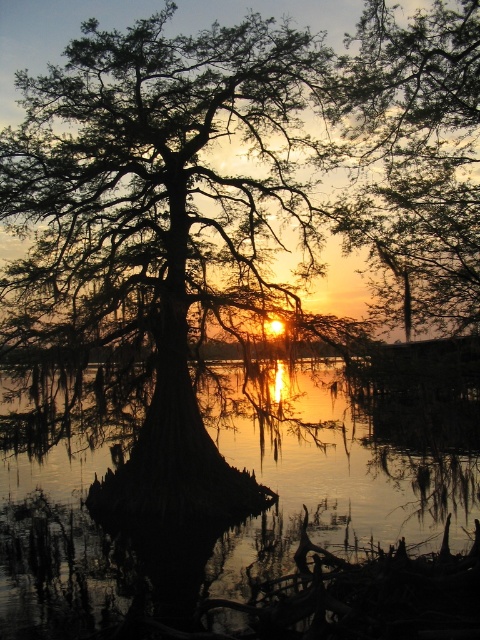
Can you confirm if silhouette wood cypress tree at center is bigger than smooth bark tree at upper center?

Yes.

Who is more distant from viewer, (184, 230) or (410, 141)?

Positioned behind is point (184, 230).

Locate an element on the screen. The image size is (480, 640). silhouette wood cypress tree at center is located at coordinates (165, 221).

Find the location of a particular element. The height and width of the screenshot is (640, 480). silhouette wood cypress tree at center is located at coordinates (165, 221).

Is silhouette wood cypress tree at center further to camera compared to glossy reflective water at center?

Yes, silhouette wood cypress tree at center is behind glossy reflective water at center.

This screenshot has width=480, height=640. Find the location of `silhouette wood cypress tree at center`. silhouette wood cypress tree at center is located at coordinates (165, 221).

This screenshot has height=640, width=480. I want to click on silhouette wood cypress tree at center, so [x=165, y=221].

Is glossy reflective water at center bigger than smooth bark tree at upper center?

Indeed, glossy reflective water at center has a larger size compared to smooth bark tree at upper center.

Does point (16, 560) come behind point (455, 96)?

Yes, point (16, 560) is farther from viewer.

The height and width of the screenshot is (640, 480). Identify the location of glossy reflective water at center. [x=247, y=516].